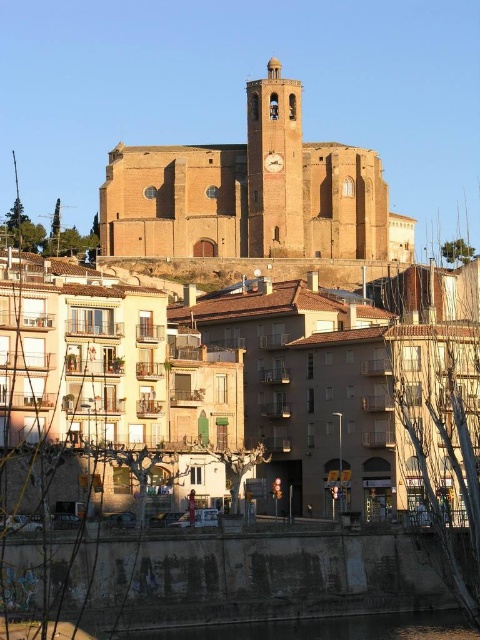
Is brown stone clock tower at upper center to the right of smooth stone clock tower at center from the viewer's perspective?

Correct, you'll find brown stone clock tower at upper center to the right of smooth stone clock tower at center.

Does point (295, 228) come behind point (276, 70)?

No.

Describe the element at coordinates (252, 193) in the screenshot. This screenshot has width=480, height=640. I see `brown stone clock tower at upper center` at that location.

You are a GUI agent. You are given a task and a screenshot of the screen. Output one action in this format:
    pyautogui.click(x=<x>, y=<y>)
    Task: Click on the brown stone clock tower at upper center
    
    Given the screenshot: What is the action you would take?
    pyautogui.click(x=252, y=193)

Between point (312, 250) and point (458, 634), which one is positioned behind?

Positioned behind is point (312, 250).

Between brown stone clock tower at upper center and black concrete river at lower center, which one is positioned higher?

Positioned higher is brown stone clock tower at upper center.

What do you see at coordinates (252, 193) in the screenshot? I see `brown stone clock tower at upper center` at bounding box center [252, 193].

The height and width of the screenshot is (640, 480). I want to click on brown stone clock tower at upper center, so click(x=252, y=193).

Consider the image. Who is lower down, smooth stone clock tower at center or black concrete river at lower center?

black concrete river at lower center

Can you confirm if smooth stone clock tower at center is positioned to the left of black concrete river at lower center?

Indeed, smooth stone clock tower at center is positioned on the left side of black concrete river at lower center.

Between point (288, 220) and point (393, 624), which one is positioned in front?

Point (393, 624) is more forward.

Where is `smooth stone clock tower at center`? The height and width of the screenshot is (640, 480). smooth stone clock tower at center is located at coordinates (274, 164).